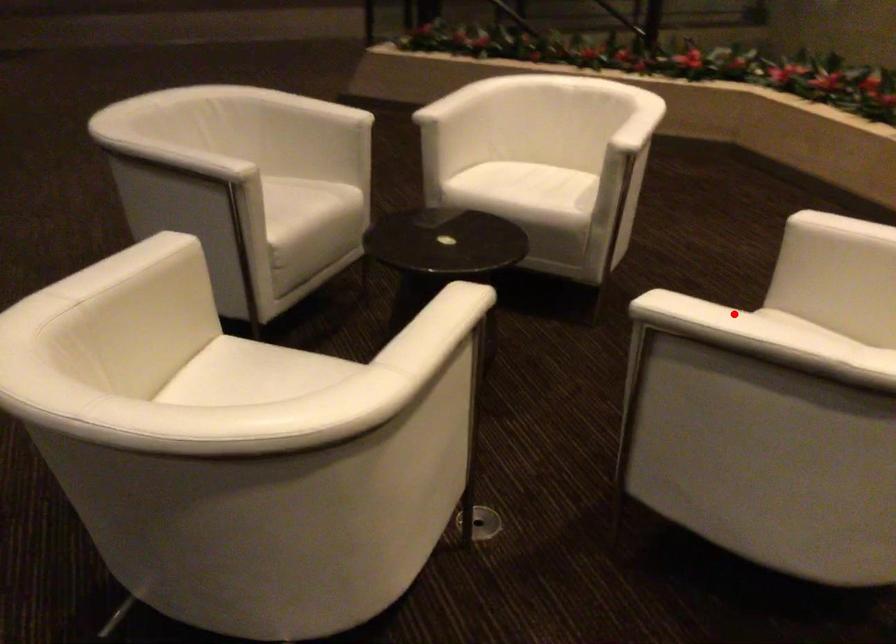
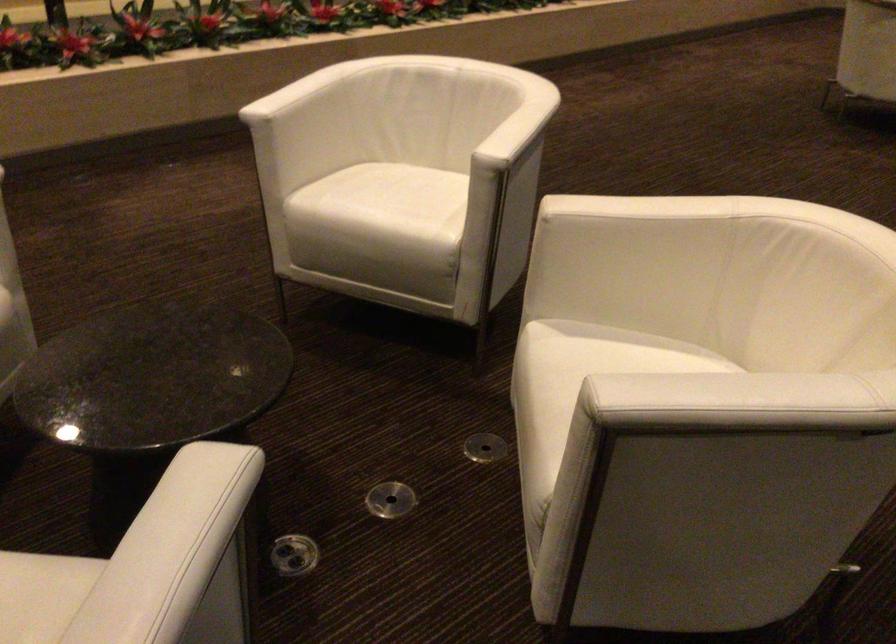
Question: I am providing you with two images of the same scene from different viewpoints. A red point is marked on the first image. Is the red point's position out of view in image 2?

Choices:
 (A) Yes
 (B) No

Answer: (B)